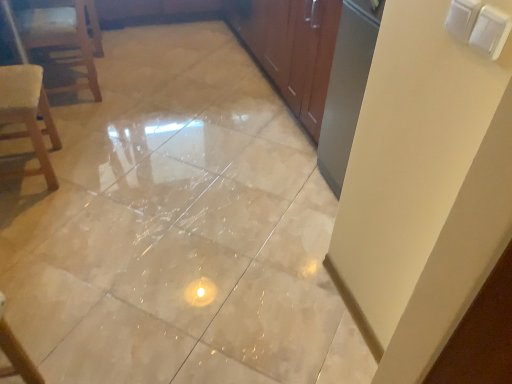
The image size is (512, 384). In order to click on empty space that is to the right of wooden chair at left in this screenshot , I will do `click(131, 96)`.